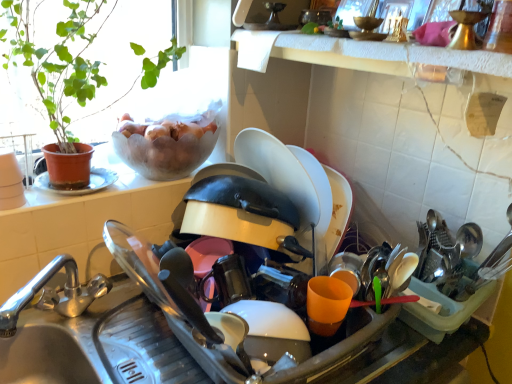
Where is `matte white sink at center`? This screenshot has height=384, width=512. matte white sink at center is located at coordinates (62, 343).

Image resolution: width=512 pixels, height=384 pixels. What do you see at coordinates (62, 343) in the screenshot?
I see `matte white sink at center` at bounding box center [62, 343].

In order to face matte white sink at center, should I rotate leftwards or rightwards?

Turn left approximately 0.312 degrees to face it.

Measure the distance between point (347, 56) and camera.

They are 29.06 inches apart.

Describe the element at coordinates (362, 53) in the screenshot. I see `white textured towel at upper center` at that location.

What is the approximate width of white textured towel at upper center?

white textured towel at upper center is 10.88 inches wide.

The height and width of the screenshot is (384, 512). Identify the location of white textured towel at upper center. (362, 53).

You are a GUI agent. You are given a task and a screenshot of the screen. Output one action in this format:
    pyautogui.click(x=<x>, y=<y>)
    Task: Click on the matte white sink at center
    The image size is (512, 384).
    Given the screenshot: What is the action you would take?
    pyautogui.click(x=62, y=343)

From the picture: Considering the positions of objects matte white sink at center and white textured towel at upper center in the image provided, who is more to the right, matte white sink at center or white textured towel at upper center?

white textured towel at upper center.

Which object is further away from the camera, matte white sink at center or white textured towel at upper center?

white textured towel at upper center is behind.

Is point (82, 358) closer to camera compared to point (456, 67)?

No, it is behind (456, 67).

From the image's perspective, is matte white sink at center under white textured towel at upper center?

Yes.

From a real-world perspective, is matte white sink at center over white textured towel at upper center?

No.

Considering the sizes of matte white sink at center and white textured towel at upper center in the image, is matte white sink at center wider or thinner than white textured towel at upper center?

matte white sink at center is wider than white textured towel at upper center.

Considering the sizes of objects matte white sink at center and white textured towel at upper center in the image provided, who is shorter, matte white sink at center or white textured towel at upper center?

With less height is white textured towel at upper center.

Is matte white sink at center smaller than white textured towel at upper center?

Actually, matte white sink at center might be larger than white textured towel at upper center.

Is white textured towel at upper center completely or partially inside matte white sink at center?

That's incorrect, white textured towel at upper center is not inside matte white sink at center.

Would you say matte white sink at center is a long distance from white textured towel at upper center?

No, matte white sink at center is not far away from white textured towel at upper center.

Is matte white sink at center facing towards white textured towel at upper center?

No, matte white sink at center does not turn towards white textured towel at upper center.

Can you tell me how much matte white sink at center and white textured towel at upper center differ in facing direction?

matte white sink at center and white textured towel at upper center are facing 90.7 degrees away from each other.

What are the coordinates of `window sill that appears on the right of matte white sink at center` in the screenshot? It's located at (362, 53).

In the image, is white textured towel at upper center on the left side or the right side of matte white sink at center?

white textured towel at upper center is positioned on matte white sink at center's right side.

Looking at this image, which is in front, white textured towel at upper center or matte white sink at center?

Positioned in front is matte white sink at center.

Is point (258, 62) closer to viewer compared to point (56, 329)?

No, (258, 62) is behind (56, 329).

From the image's perspective, between white textured towel at upper center and matte white sink at center, which one is located above?

white textured towel at upper center is shown above in the image.

From a real-world perspective, which object rests below the other?

matte white sink at center is physically lower.

Is white textured towel at upper center wider than matte white sink at center?

No, white textured towel at upper center is not wider than matte white sink at center.

Between white textured towel at upper center and matte white sink at center, which one has more height?

Standing taller between the two is matte white sink at center.

Considering the sizes of objects white textured towel at upper center and matte white sink at center in the image provided, who is bigger, white textured towel at upper center or matte white sink at center?

matte white sink at center.

Is matte white sink at center completely or partially inside white textured towel at upper center?

No, matte white sink at center is not inside white textured towel at upper center.

Would you consider white textured towel at upper center to be distant from matte white sink at center?

No, white textured towel at upper center is in close proximity to matte white sink at center.

Is white textured towel at upper center facing towards matte white sink at center?

No, white textured towel at upper center is not turned towards matte white sink at center.

How different are the orientations of white textured towel at upper center and matte white sink at center in degrees?

The facing directions of white textured towel at upper center and matte white sink at center are 90.7 degrees apart.

How far apart are white textured towel at upper center and matte white sink at center?

white textured towel at upper center and matte white sink at center are 20.68 inches apart from each other.

In the image, there is a white textured towel at upper center. What are the coordinates of `sink below it (from a real-world perspective)` in the screenshot? It's located at (62, 343).

Where is `sink that is in front of the white textured towel at upper center`? The image size is (512, 384). sink that is in front of the white textured towel at upper center is located at coordinates (62, 343).

You are a GUI agent. You are given a task and a screenshot of the screen. Output one action in this format:
    pyautogui.click(x=<x>, y=<y>)
    Task: Click on the window sill above the matte white sink at center (from a real-world perspective)
    The width and height of the screenshot is (512, 384).
    Given the screenshot: What is the action you would take?
    pyautogui.click(x=362, y=53)